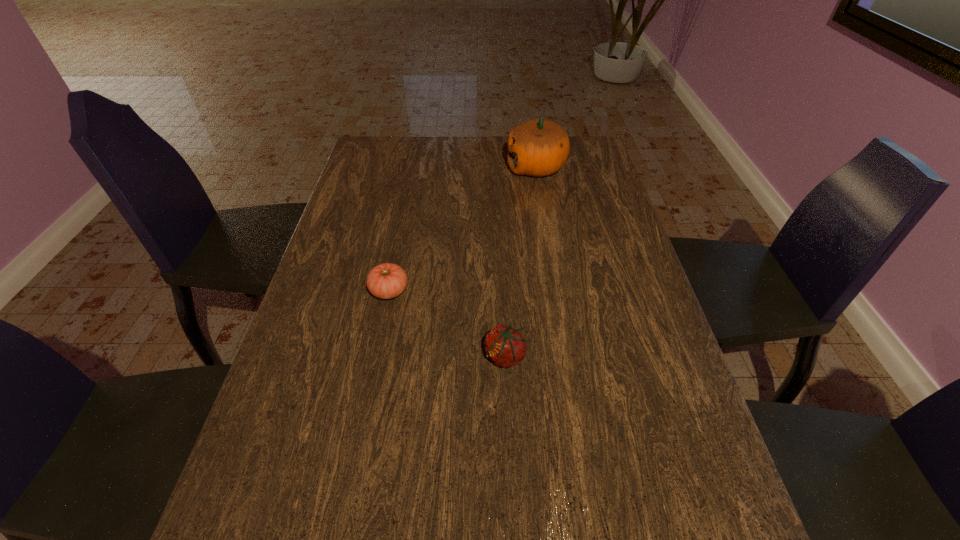
Point out which object is positioned as the second nearest to the farthest object. Please provide its 2D coordinates. Your answer should be formatted as a tuple, i.e. [(x, y)], where the tuple contains the x and y coordinates of a point satisfying the conditions above.

[(505, 346)]

Identify the location of blank space that satisfies the following two spatial constraints: 1. on the face of the tallest object; 2. on the front side of the nearer tomato. The image size is (960, 540). (568, 356).

Where is `vacant area that satisfies the following two spatial constraints: 1. on the face of the tallest object; 2. on the front side of the nearest object`? The width and height of the screenshot is (960, 540). vacant area that satisfies the following two spatial constraints: 1. on the face of the tallest object; 2. on the front side of the nearest object is located at coordinates (568, 356).

Where is `free location that satisfies the following two spatial constraints: 1. on the face of the farthest object; 2. on the front side of the farther tomato`? This screenshot has width=960, height=540. free location that satisfies the following two spatial constraints: 1. on the face of the farthest object; 2. on the front side of the farther tomato is located at coordinates (558, 291).